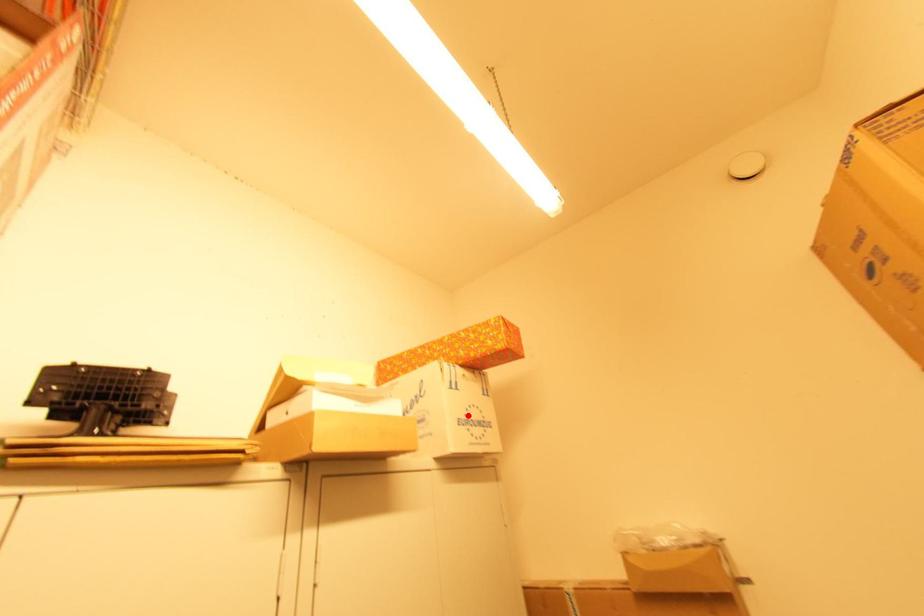
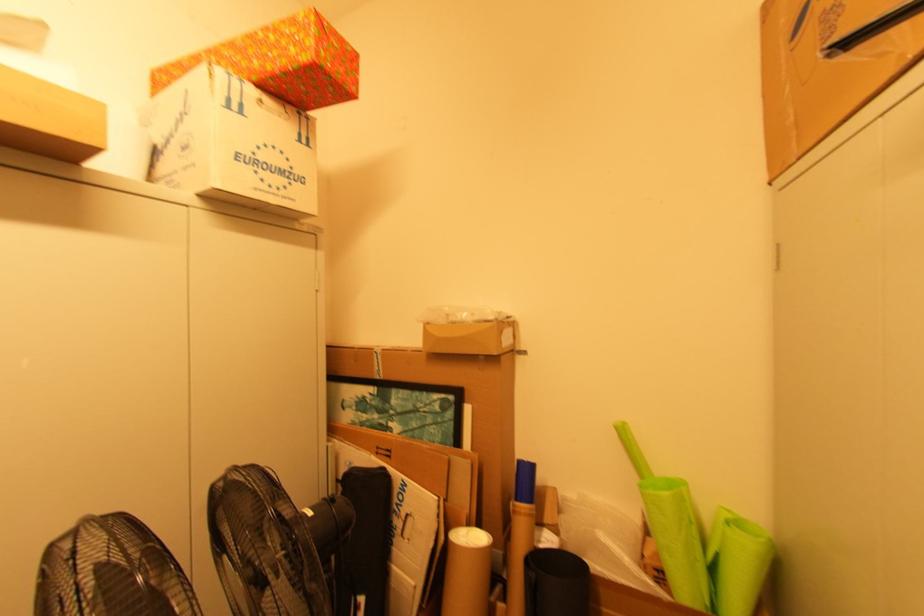
Find the pixel in the second image that matches the highlighted location in the first image.

(257, 154)